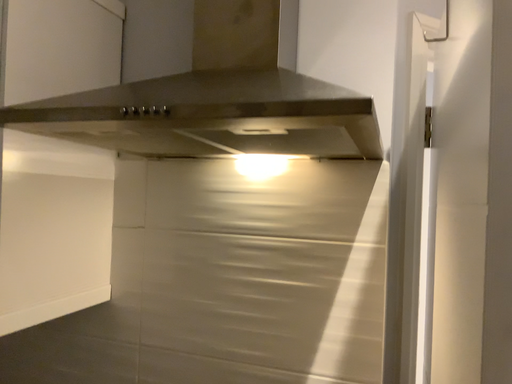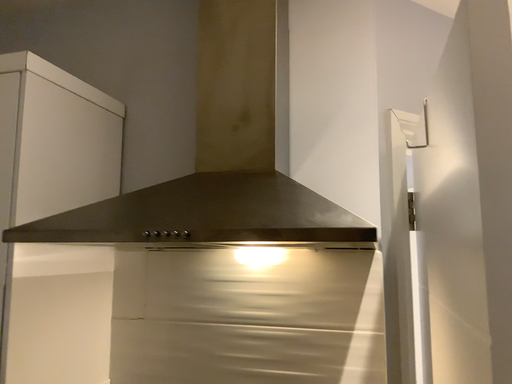
Question: How did the camera likely rotate when shooting the video?

Choices:
 (A) rotated upward
 (B) rotated downward

Answer: (A)